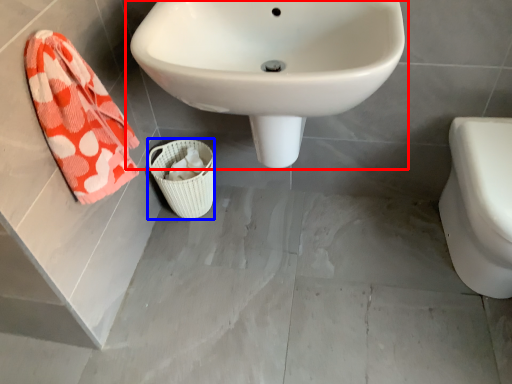
Question: Which point is closer to the camera, sink (highlighted by a red box) or basket (highlighted by a blue box)?

Choices:
 (A) sink
 (B) basket

Answer: (A)